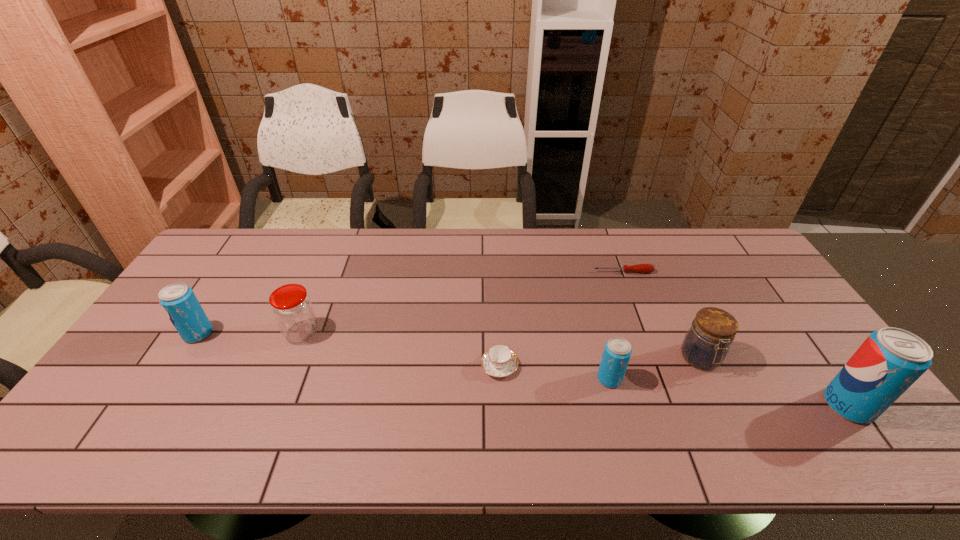
This screenshot has height=540, width=960. Identify the location of the fifth object from right to left. (499, 361).

Find the location of a particular element. Image resolution: width=960 pixels, height=540 pixels. teacup is located at coordinates (499, 361).

At what (x,y) coordinates should I click in order to perform the action: click on blank area located on the back of the leftmost soda can. Please return your answer as a coordinate pair (x, y). The image size is (960, 540). Looking at the image, I should click on (252, 248).

Locate an element on the screen. blank area located 0.200m on the back of the fourth object from right to left is located at coordinates (592, 314).

You are a GUI agent. You are given a task and a screenshot of the screen. Output one action in this format:
    pyautogui.click(x=<x>, y=<y>)
    Task: Click on the blank space located on the left of the tallest object
    
    Given the screenshot: What is the action you would take?
    [x=764, y=405]

The height and width of the screenshot is (540, 960). I want to click on free space located on the right of the farthest object, so click(751, 272).

Identify the location of free space located 0.100m on the lid of the right jar. point(726,411).

Identify the location of free point located 0.250m on the right of the left jar. The image size is (960, 540). (407, 332).

Identify the location of vacant space situated on the side with the handle of the sixth tallest object. The height and width of the screenshot is (540, 960). (647, 366).

Find the location of a particular element. object that is at the far edge is located at coordinates (642, 268).